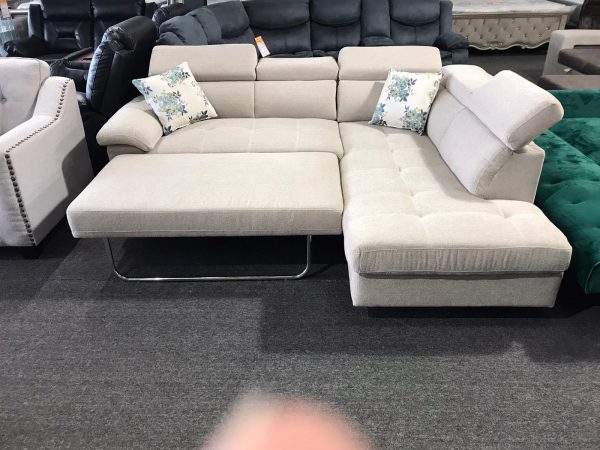
Where is `ivory sectional`? ivory sectional is located at coordinates (255, 158), (383, 153), (443, 183), (298, 97).